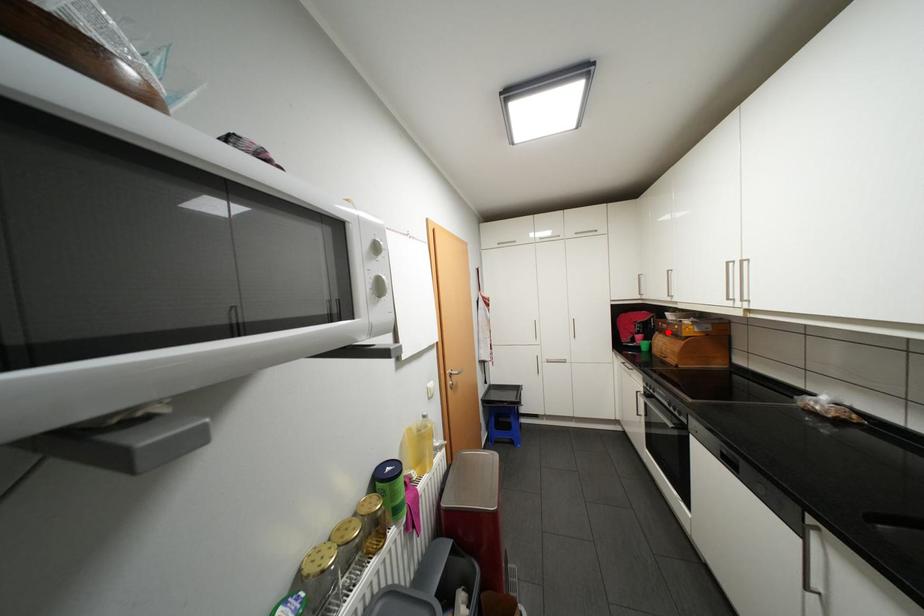
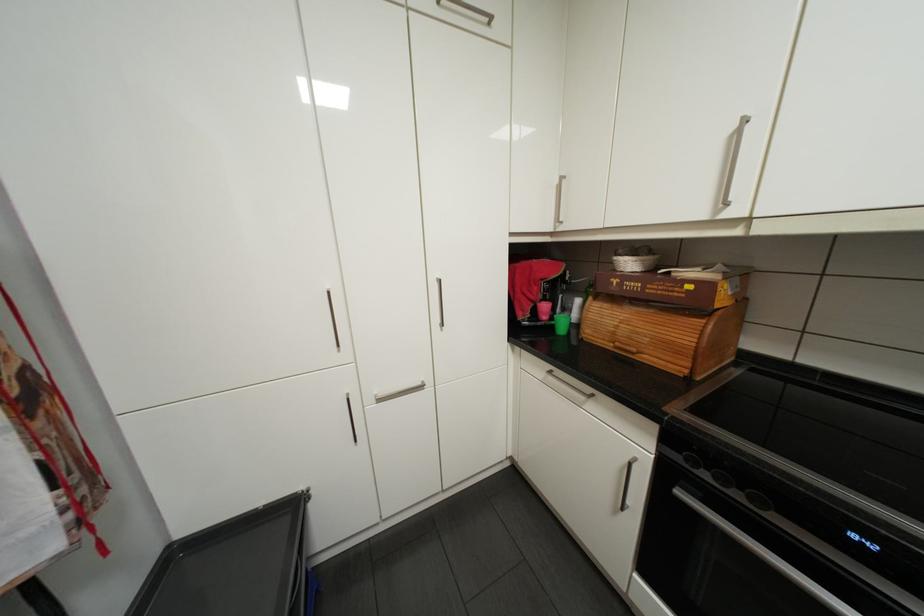
Question: I am providing you with two images of the same scene from different viewpoints. A red point is marked on the first image. Can you still see the location of the red point in image 2?

Choices:
 (A) Yes
 (B) No

Answer: (A)